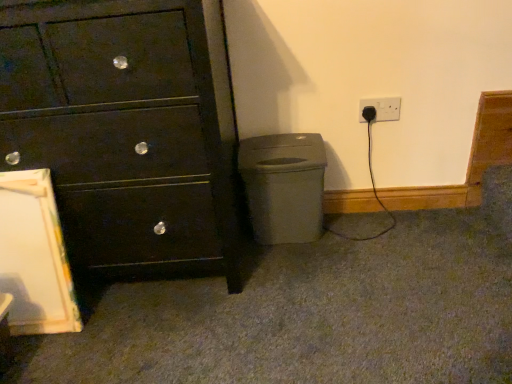
Locate an element on the screen. free location to the right of matte gray plastic at lower right is located at coordinates (353, 229).